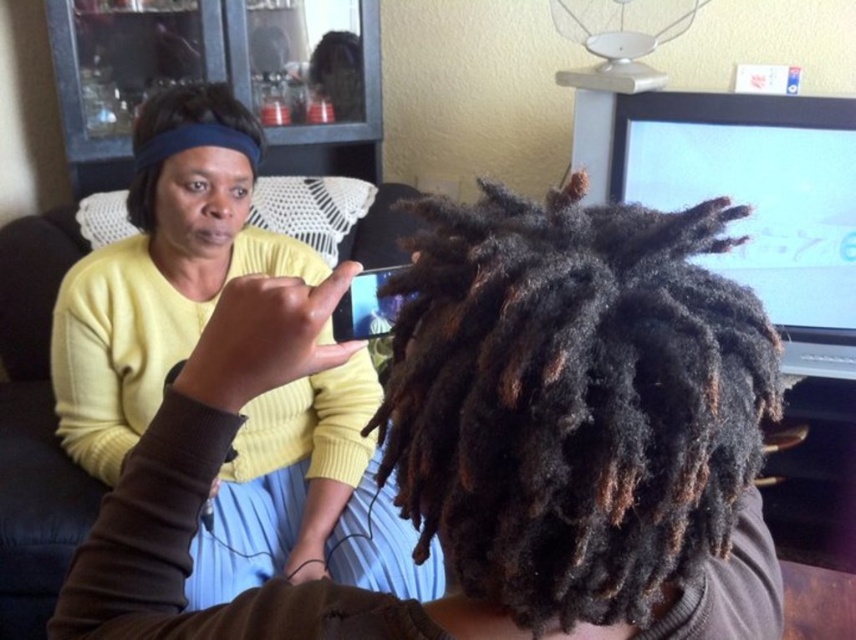
Question: Which point appears farthest from the camera in this image?

Choices:
 (A) (364, 289)
 (B) (180, 292)
 (C) (138, 209)
 (D) (759, 396)

Answer: (A)

Question: Does matte yellow sweater at upper left have a smaller size compared to black matte hair at upper left?

Choices:
 (A) yes
 (B) no

Answer: (B)

Question: Which is farther from the matte black phone at center?

Choices:
 (A) dark curly hair at center
 (B) black matte hair at upper left

Answer: (A)

Question: Does matte yellow sweater at upper left appear on the right side of black matte hair at upper left?

Choices:
 (A) yes
 (B) no

Answer: (A)

Question: Does dark curly hair at center appear over matte black phone at center?

Choices:
 (A) no
 (B) yes

Answer: (A)

Question: Considering the real-world distances, which object is closest to the matte yellow sweater at upper left?

Choices:
 (A) black matte hair at upper left
 (B) dark curly hair at center

Answer: (A)